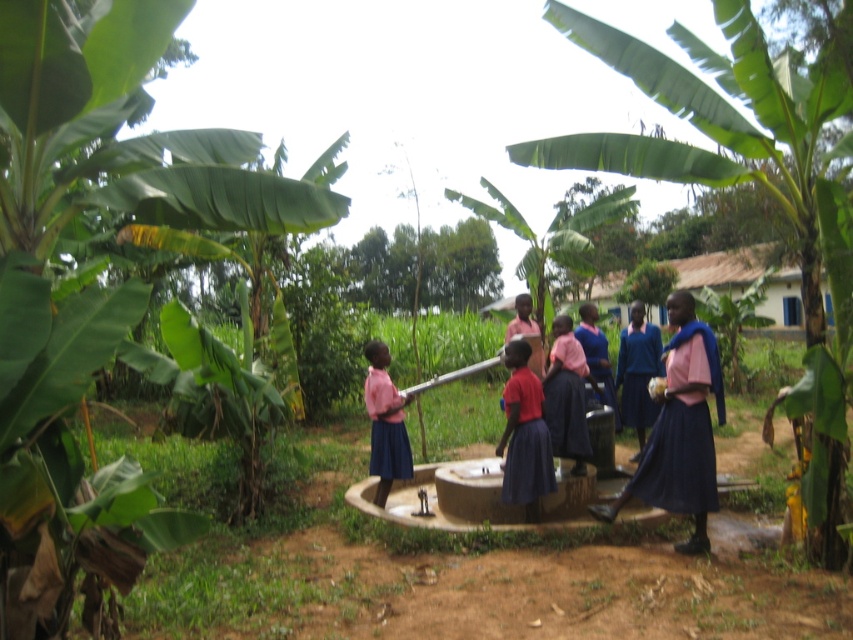
Does green leafy banana tree at left lie behind matte pink shirt at center?

No, green leafy banana tree at left is in front of matte pink shirt at center.

Is green leafy banana tree at left positioned before matte pink shirt at center?

Yes, it is in front of matte pink shirt at center.

Describe the element at coordinates (94, 285) in the screenshot. I see `green leafy banana tree at left` at that location.

Identify the location of green leafy banana tree at left. The image size is (853, 640). (94, 285).

Which is more to the right, matte pink shirt at center or matte blue skirt at center?

Positioned to the right is matte pink shirt at center.

Which is more to the left, matte pink shirt at center or matte blue skirt at center?

matte blue skirt at center

Does point (535, 465) come behind point (387, 493)?

That is False.

Locate an element on the screen. This screenshot has width=853, height=640. matte pink shirt at center is located at coordinates (524, 435).

Who is lower down, green leafy banana tree at left or matte blue skirt at center?

matte blue skirt at center is below.

Which is above, green leafy banana tree at left or matte blue skirt at center?

Positioned higher is green leafy banana tree at left.

Between point (28, 483) and point (399, 396), which one is positioned behind?

Point (399, 396)

Where is `green leafy banana tree at left`? green leafy banana tree at left is located at coordinates (94, 285).